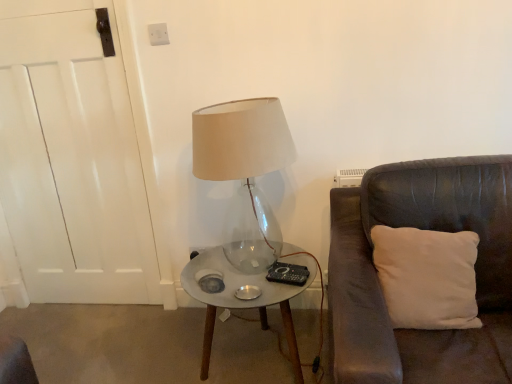
Question: Is white soft cushion at right taller than transparent glass lamp at center?

Choices:
 (A) yes
 (B) no

Answer: (B)

Question: Is white soft cushion at right at the left side of transparent glass lamp at center?

Choices:
 (A) yes
 (B) no

Answer: (B)

Question: Is white soft cushion at right positioned in front of transparent glass lamp at center?

Choices:
 (A) no
 (B) yes

Answer: (B)

Question: Considering the relative positions of white soft cushion at right and transparent glass lamp at center in the image provided, is white soft cushion at right to the right of transparent glass lamp at center from the viewer's perspective?

Choices:
 (A) yes
 (B) no

Answer: (A)

Question: Can you confirm if white soft cushion at right is shorter than transparent glass lamp at center?

Choices:
 (A) no
 (B) yes

Answer: (B)

Question: Is point (462, 264) closer or farther from the camera than point (256, 102)?

Choices:
 (A) farther
 (B) closer

Answer: (B)

Question: Looking at the image, does white soft cushion at right seem bigger or smaller compared to transparent glass lamp at center?

Choices:
 (A) small
 (B) big

Answer: (A)

Question: Which is correct: white soft cushion at right is inside transparent glass lamp at center, or outside of it?

Choices:
 (A) outside
 (B) inside

Answer: (A)

Question: In terms of width, does white soft cushion at right look wider or thinner when compared to transparent glass lamp at center?

Choices:
 (A) thin
 (B) wide

Answer: (A)

Question: Is transparent glass lamp at center spatially inside clear glass table at center, or outside of it?

Choices:
 (A) inside
 (B) outside

Answer: (B)

Question: From the image's perspective, relative to clear glass table at center, is transparent glass lamp at center above or below?

Choices:
 (A) below
 (B) above

Answer: (B)

Question: From a real-world perspective, is transparent glass lamp at center above or below clear glass table at center?

Choices:
 (A) below
 (B) above

Answer: (B)

Question: In terms of width, does transparent glass lamp at center look wider or thinner when compared to clear glass table at center?

Choices:
 (A) thin
 (B) wide

Answer: (A)

Question: Is point (270, 296) closer or farther from the camera than point (374, 246)?

Choices:
 (A) farther
 (B) closer

Answer: (A)

Question: From the image's perspective, relative to white soft cushion at right, is clear glass table at center above or below?

Choices:
 (A) below
 (B) above

Answer: (A)